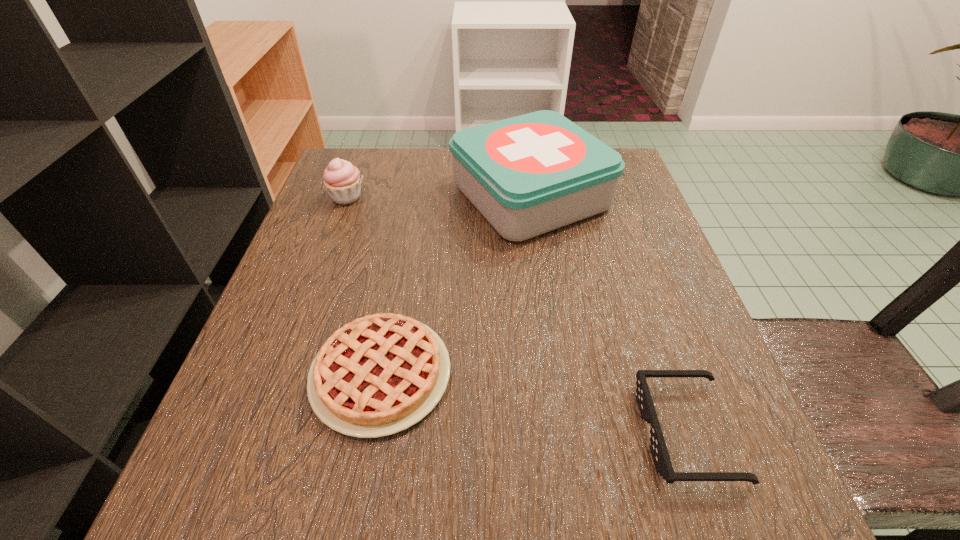
You are a GUI agent. You are given a task and a screenshot of the screen. Output one action in this format:
    pyautogui.click(x=<x>, y=<y>)
    Task: Click on the blank region between the sunglasses and the cupcake
    
    Given the screenshot: What is the action you would take?
    pyautogui.click(x=516, y=315)

You are a GUI agent. You are given a task and a screenshot of the screen. Output one action in this format:
    pyautogui.click(x=<x>, y=<y>)
    Task: Click on the empty space that is in between the first-aid kit and the sunglasses
    The width and height of the screenshot is (960, 540).
    Given the screenshot: What is the action you would take?
    pyautogui.click(x=609, y=314)

The image size is (960, 540). I want to click on free space between the sunglasses and the leftmost object, so [516, 315].

Find the location of a particular element. This screenshot has width=960, height=540. free spot between the first-aid kit and the sunglasses is located at coordinates (609, 314).

Find the location of `vacant space that's between the pie and the leftmost object`. vacant space that's between the pie and the leftmost object is located at coordinates (364, 286).

Identify the location of vacant area that lies between the sunglasses and the first-aid kit. The image size is (960, 540). (609, 314).

Find the location of a particular element. free space between the sunglasses and the tallest object is located at coordinates (609, 314).

At what (x,y) coordinates should I click in order to perform the action: click on vacant space that is in between the first-aid kit and the leftmost object. Please return your answer as a coordinate pair (x, y). Looking at the image, I should click on (439, 197).

Point out which object is positioned as the nearest to the first-aid kit. Please provide its 2D coordinates. Your answer should be formatted as a tuple, i.e. [(x, y)], where the tuple contains the x and y coordinates of a point satisfying the conditions above.

[(378, 375)]

Identify which object is located as the third nearest to the pie. Please provide its 2D coordinates. Your answer should be formatted as a tuple, i.e. [(x, y)], where the tuple contains the x and y coordinates of a point satisfying the conditions above.

[(342, 180)]